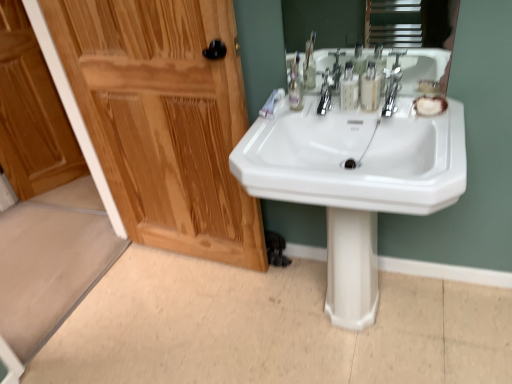
Where is `vacant area that is situated to the right of white glossy pedestal at center`? The image size is (512, 384). vacant area that is situated to the right of white glossy pedestal at center is located at coordinates (407, 303).